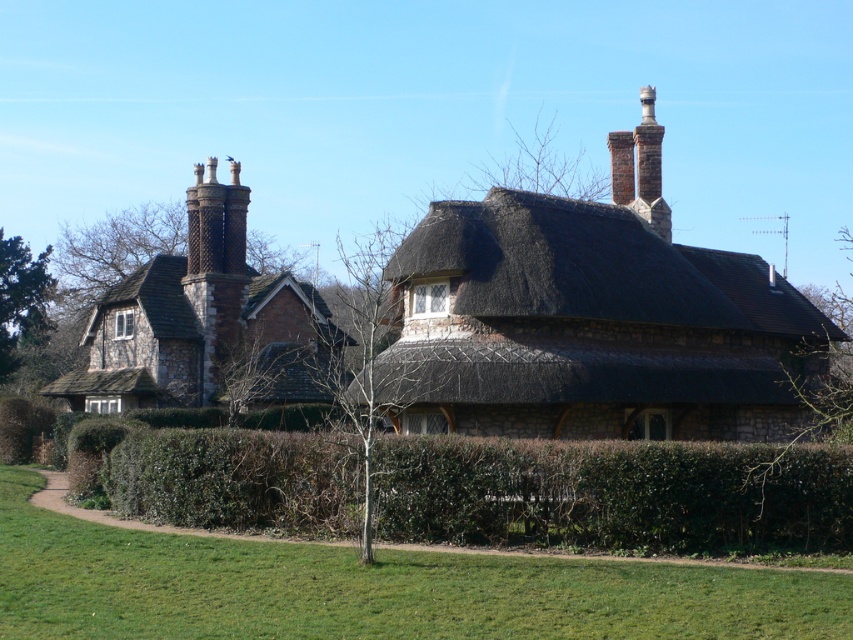
Between rustic stone chimney at upper left and bare branches at upper right, which one appears on the left side from the viewer's perspective?

From the viewer's perspective, rustic stone chimney at upper left appears more on the left side.

Which of these two, rustic stone chimney at upper left or bare branches at upper right, stands shorter?

With less height is rustic stone chimney at upper left.

At what (x,y) coordinates should I click in order to perform the action: click on rustic stone chimney at upper left. Please return your answer as a coordinate pair (x, y). This screenshot has width=853, height=640. Looking at the image, I should click on (204, 321).

Which is below, thatched roof at center or rustic stone chimney at upper left?

rustic stone chimney at upper left is lower down.

Which of these two, thatched roof at center or rustic stone chimney at upper left, stands taller?

rustic stone chimney at upper left

Is point (512, 262) positioned behind point (281, 310)?

No.

Where is `thatched roof at center`? The height and width of the screenshot is (640, 853). thatched roof at center is located at coordinates tap(593, 268).

Can you confirm if rustic stone chimney at upper left is shorter than green leafy tree at left?

No.

Where is `rustic stone chimney at upper left`? rustic stone chimney at upper left is located at coordinates (204, 321).

In order to click on rustic stone chimney at upper left in this screenshot , I will do `click(204, 321)`.